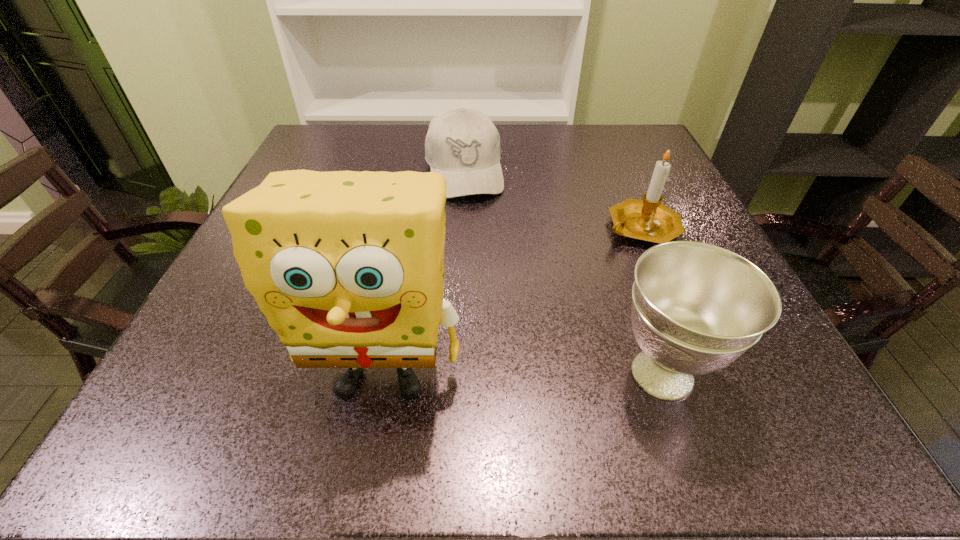
Locate an element on the screen. vacant space that's between the sponge and the third nearest object is located at coordinates (512, 301).

Choose which object is the nearest neighbor to the tallest object. Please provide its 2D coordinates. Your answer should be formatted as a tuple, i.e. [(x, y)], where the tuple contains the x and y coordinates of a point satisfying the conditions above.

[(696, 307)]

Identify which object is located as the second nearest to the farthest object. Please provide its 2D coordinates. Your answer should be formatted as a tuple, i.e. [(x, y)], where the tuple contains the x and y coordinates of a point satisfying the conditions above.

[(348, 267)]

Locate an element on the screen. free space that satisfies the following two spatial constraints: 1. on the front side of the farthest object; 2. on the left side of the second farthest object is located at coordinates (461, 228).

At what (x,y) coordinates should I click in order to perform the action: click on vacant space that satisfies the following two spatial constraints: 1. on the front side of the baseball cap; 2. on the left side of the chalice. Please return your answer as a coordinate pair (x, y). This screenshot has width=960, height=540. Looking at the image, I should click on (453, 374).

The width and height of the screenshot is (960, 540). Find the location of `vacant space that satisfies the following two spatial constraints: 1. on the front side of the candle holder; 2. on the right side of the shortest object`. vacant space that satisfies the following two spatial constraints: 1. on the front side of the candle holder; 2. on the right side of the shortest object is located at coordinates (461, 228).